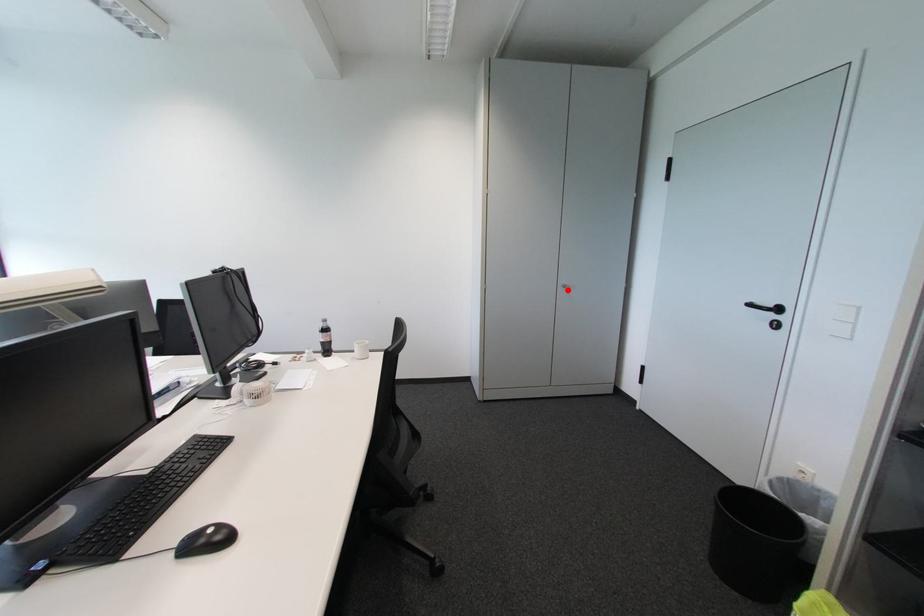
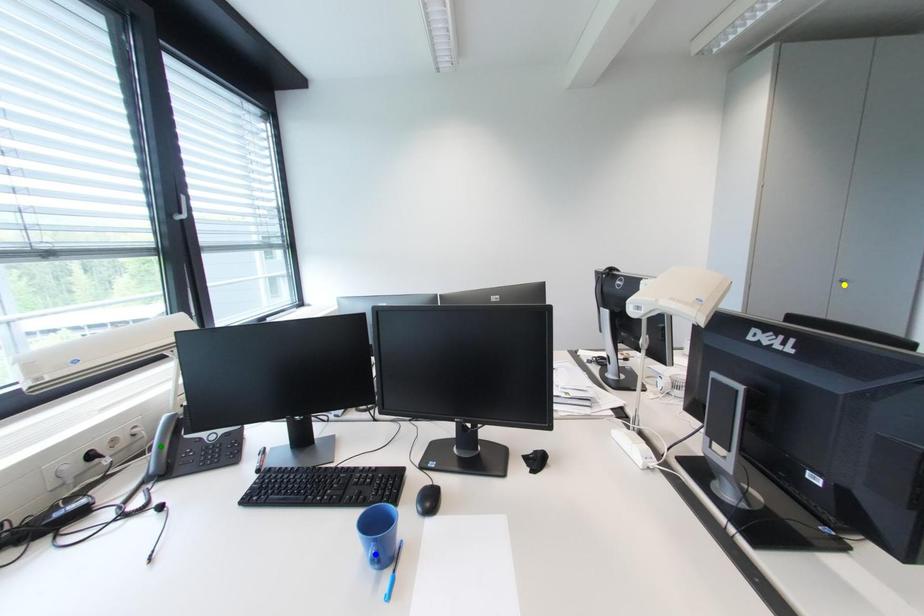
Question: I am providing you with two images of the same scene from different viewpoints. A red point is marked on the first image. You are given multiple points on the second image. Which point in image 2 is actually the same real-world point as the red point in image 1?

Choices:
 (A) yellow point
 (B) blue point
 (C) green point

Answer: (A)